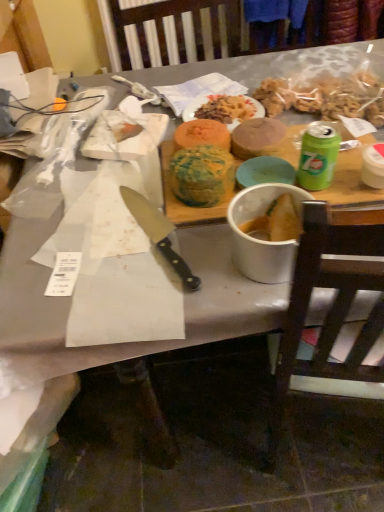
Find the location of a particular element. The image size is (384, 512). vacant area in front of black plastic knife at center is located at coordinates (150, 296).